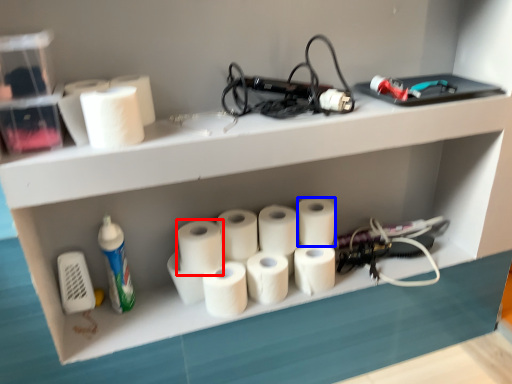
Question: Among these objects, which one is nearest to the camera, paper towel (highlighted by a red box) or paper towel (highlighted by a blue box)?

Choices:
 (A) paper towel
 (B) paper towel

Answer: (A)